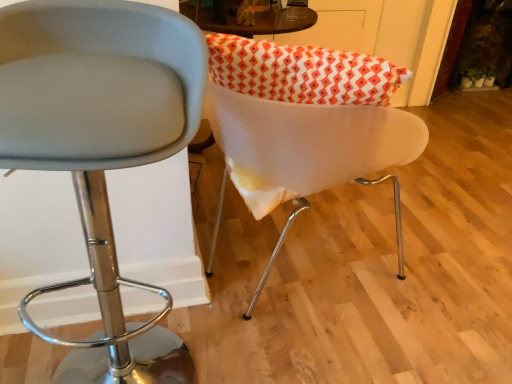
Question: Considering the relative positions of matte gray stool at center, the second chair from the right, and white glossy chair at center, the second chair from the left, in the image provided, is matte gray stool at center, the second chair from the right, to the left or to the right of white glossy chair at center, the second chair from the left,?

Choices:
 (A) left
 (B) right

Answer: (A)

Question: Considering the positions of matte gray stool at center, which is counted as the 1th chair, starting from the left, and white glossy chair at center, the second chair from the left, in the image, is matte gray stool at center, which is counted as the 1th chair, starting from the left, taller or shorter than white glossy chair at center, the second chair from the left,?

Choices:
 (A) short
 (B) tall

Answer: (B)

Question: In terms of size, does matte gray stool at center, which is counted as the 1th chair, starting from the left, appear bigger or smaller than white glossy chair at center, the second chair from the left?

Choices:
 (A) small
 (B) big

Answer: (B)

Question: Considering the positions of white glossy chair at center, which ranks as the first chair in right-to-left order, and matte gray stool at center, which is counted as the 1th chair, starting from the left, in the image, is white glossy chair at center, which ranks as the first chair in right-to-left order, wider or thinner than matte gray stool at center, which is counted as the 1th chair, starting from the left,?

Choices:
 (A) wide
 (B) thin

Answer: (A)

Question: Is white glossy chair at center, the second chair from the left, spatially inside matte gray stool at center, the second chair from the right, or outside of it?

Choices:
 (A) outside
 (B) inside

Answer: (A)

Question: Is point (402, 278) positioned closer to the camera than point (117, 278)?

Choices:
 (A) closer
 (B) farther

Answer: (B)

Question: Relative to matte gray stool at center, the second chair from the right, is white glossy chair at center, the second chair from the left, in front or behind?

Choices:
 (A) behind
 (B) front

Answer: (A)